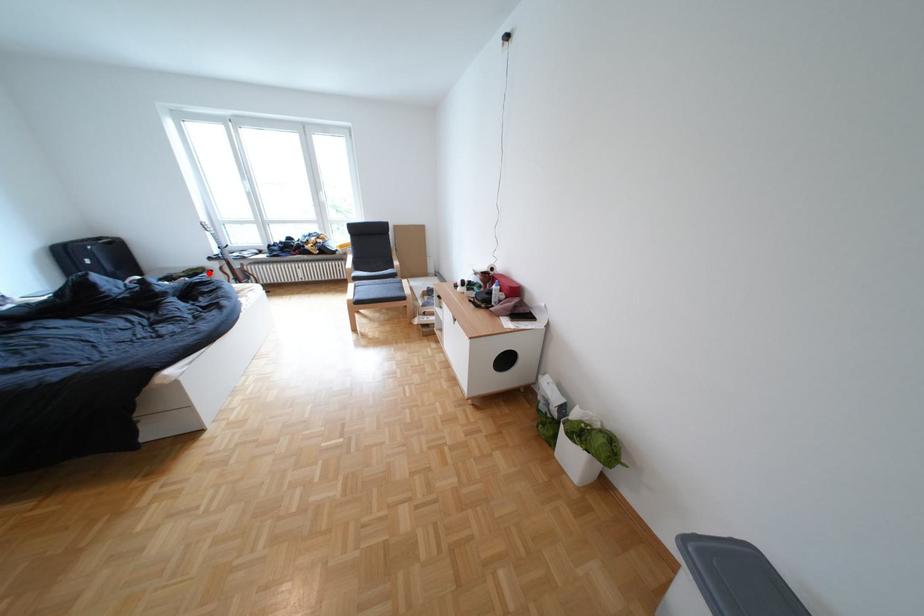
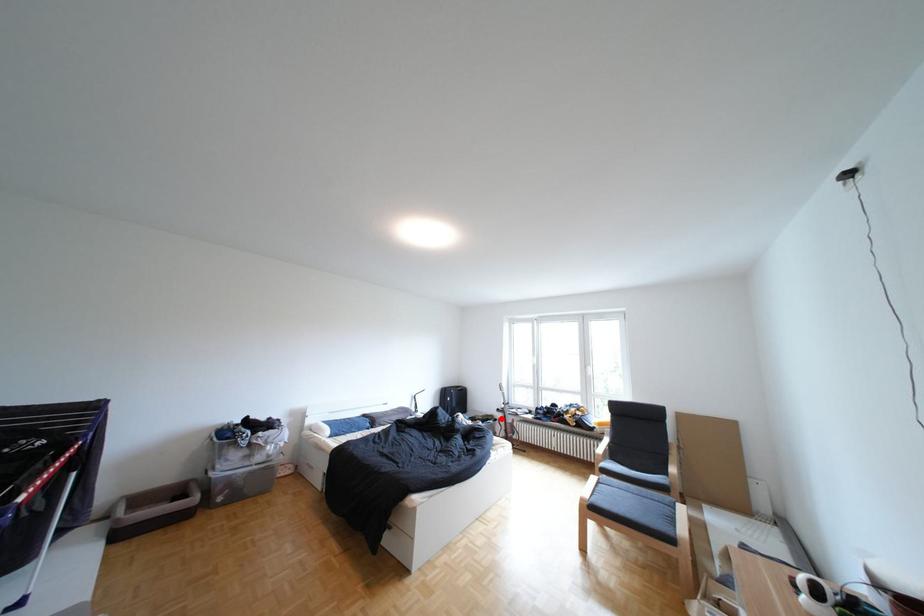
I am providing you with two images of the same scene from different viewpoints. A red point is marked on the first image and another point is marked on the second image. Is the red point in image1 aligned with the point shown in image2?

Yes